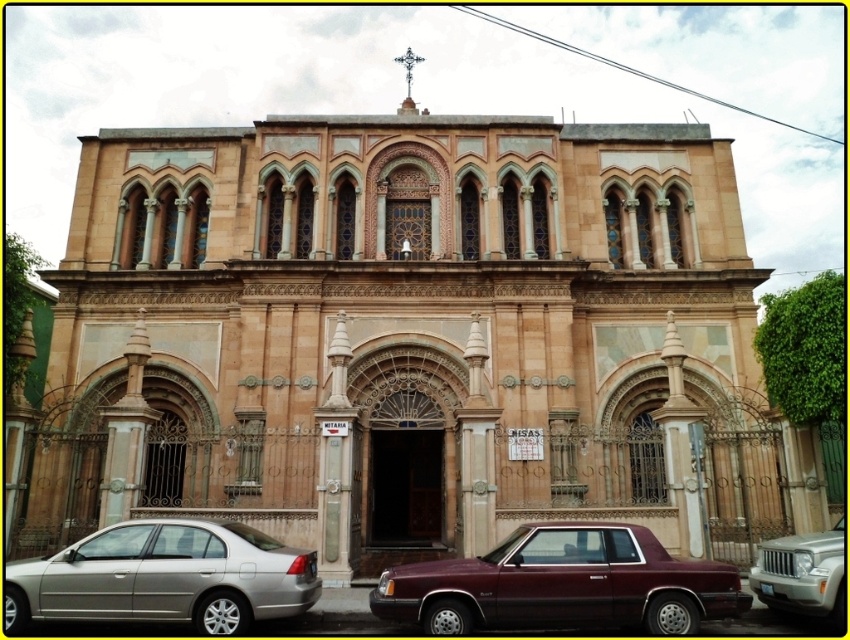
Question: Does silver metallic sedan at lower left come in front of silver metallic suv at lower right?

Choices:
 (A) no
 (B) yes

Answer: (B)

Question: Which point is closer to the camera taking this photo?

Choices:
 (A) tap(182, 616)
 (B) tap(765, 576)

Answer: (A)

Question: Among these points, which one is farthest from the camera?

Choices:
 (A) (129, 541)
 (B) (819, 611)

Answer: (A)

Question: Estimate the real-world distances between objects in this image. Which object is closer to the silver metallic sedan at lower left?

Choices:
 (A) maroon metallic car at center
 (B) silver metallic suv at lower right

Answer: (A)

Question: Does maroon metallic car at center appear under silver metallic suv at lower right?

Choices:
 (A) no
 (B) yes

Answer: (B)

Question: Does maroon metallic car at center appear on the left side of silver metallic suv at lower right?

Choices:
 (A) yes
 (B) no

Answer: (A)